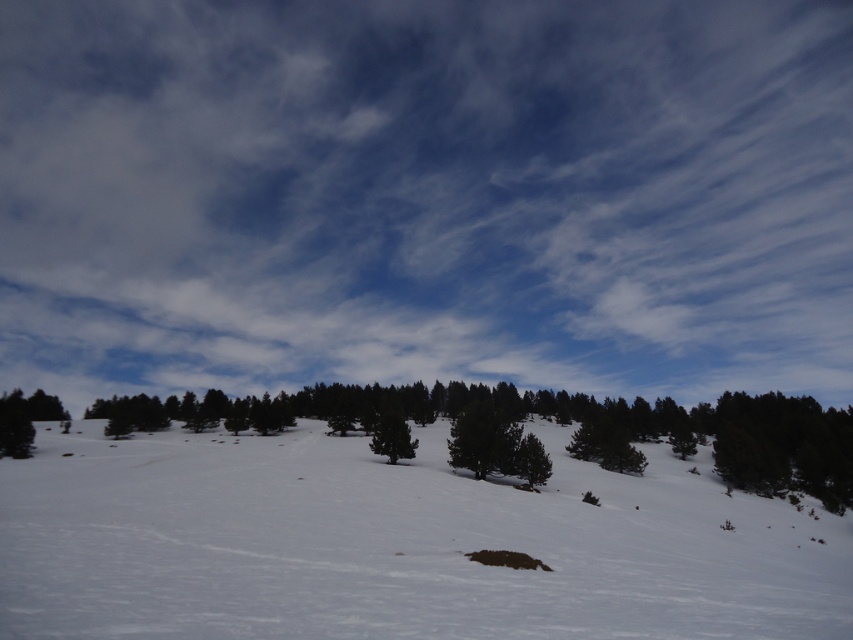
Can you confirm if white fluffy cloud at upper center is positioned to the right of green matte tree at center?

Correct, you'll find white fluffy cloud at upper center to the right of green matte tree at center.

Can you confirm if white fluffy cloud at upper center is taller than green matte tree at center?

Yes.

Which is in front, point (738, 22) or point (399, 433)?

Point (399, 433) is in front.

This screenshot has width=853, height=640. Identify the location of white fluffy cloud at upper center. (426, 195).

Which of these two, white powdery snow at center or green matte tree at center, stands shorter?

Standing shorter between the two is green matte tree at center.

You are a GUI agent. You are given a task and a screenshot of the screen. Output one action in this format:
    pyautogui.click(x=<x>, y=<y>)
    Task: Click on the white powdery snow at center
    The image size is (853, 640).
    Given the screenshot: What is the action you would take?
    395,544

Is white fluffy cloud at upper center to the left of white powdery snow at center from the viewer's perspective?

Incorrect, white fluffy cloud at upper center is not on the left side of white powdery snow at center.

Which is behind, point (238, 337) or point (310, 506)?

The point (238, 337) is behind.

Where is `white fluffy cloud at upper center`? The width and height of the screenshot is (853, 640). white fluffy cloud at upper center is located at coordinates (426, 195).